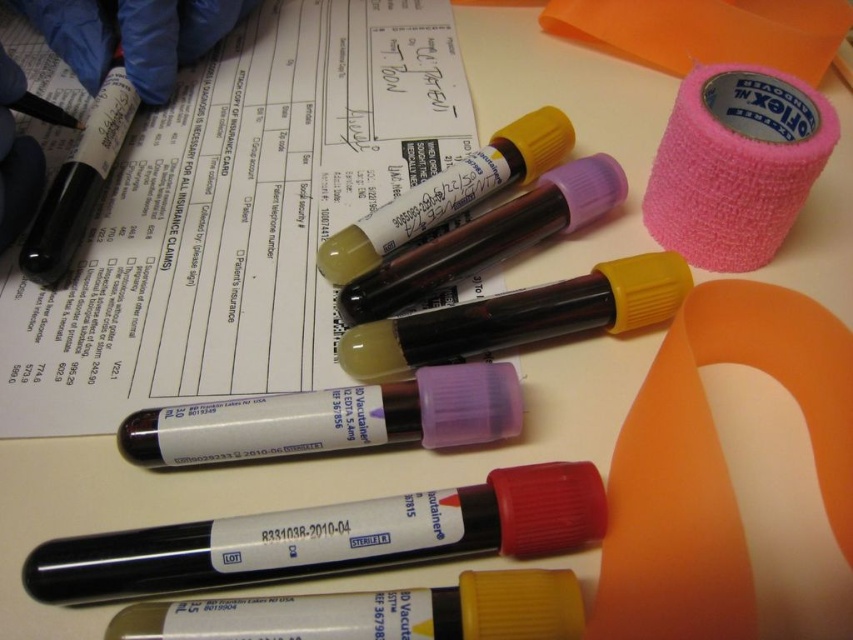
You are a nurse preparing to document a patient visit. You have a matte black pen at lower center and a pink fabric tape at upper right. Which item is longer?

The pink fabric tape at upper right is longer than the matte black pen at lower center.

You are a medical assistant who needs to hand the white paper at center to the doctor standing behind you. Can you reach it without moving your position? Assume your arm can extend 28 inches forward.

The white paper at center is 32.56 inches from the viewer. Since your arm can only extend 28 inches, you cannot reach it without moving your position.

You are a medical technician holding a magnifying glass. You need to inspect two points in the image for clarity. The first point is at coordinate point [260,88] and the second is at coordinate point [33,566]. Which point will appear larger in your magnifying glass view?

Point [260,88] is further to the camera than point [33,566], so it will appear larger in the magnifying glass view.